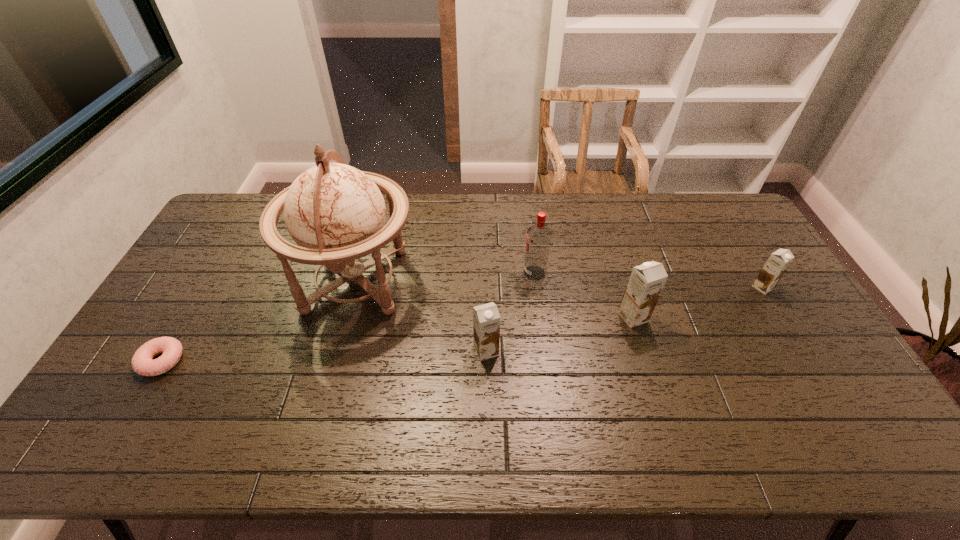
At what (x,y) coordinates should I click in order to perform the action: click on object that is at the left edge. Please return your answer as a coordinate pair (x, y). Image resolution: width=960 pixels, height=540 pixels. Looking at the image, I should click on coord(142,363).

Locate an element on the screen. The image size is (960, 540). object located at the right edge is located at coordinates (778, 262).

In order to click on object positioned at the near left corner in this screenshot , I will do `click(142, 363)`.

Where is `vacant space at the far edge of the desktop`? This screenshot has width=960, height=540. vacant space at the far edge of the desktop is located at coordinates 559,225.

I want to click on vacant area at the near edge, so click(x=666, y=381).

I want to click on free space at the right edge of the desktop, so click(x=746, y=306).

Image resolution: width=960 pixels, height=540 pixels. In order to click on vacant space at the near left corner of the desktop in this screenshot , I will do `click(165, 397)`.

In the image, there is a desktop. Where is `vacant space at the far right corner`? Image resolution: width=960 pixels, height=540 pixels. vacant space at the far right corner is located at coordinates (712, 205).

Where is `vacant space that is in between the doughnut and the third object from right to left`? The width and height of the screenshot is (960, 540). vacant space that is in between the doughnut and the third object from right to left is located at coordinates (348, 317).

At what (x,y) coordinates should I click in order to perform the action: click on unoccupied position between the leftmost object and the leftmost chocolate milk. Please return your answer as a coordinate pair (x, y). This screenshot has height=540, width=960. Looking at the image, I should click on (324, 355).